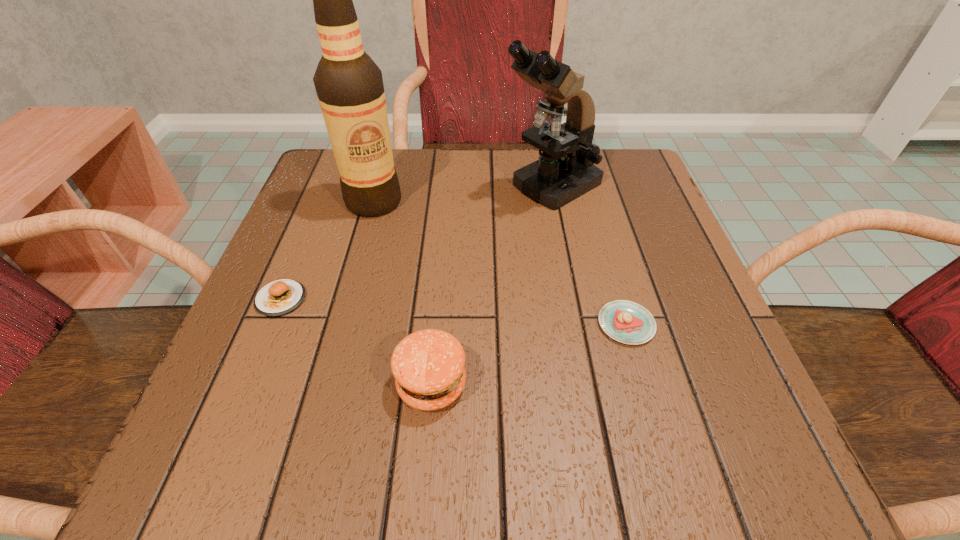
Find the location of `alcohol`. alcohol is located at coordinates (349, 85).

At what (x,y) coordinates should I click in order to perform the action: click on the fourth object from right to left. Please return your answer as a coordinate pair (x, y). This screenshot has height=540, width=960. Looking at the image, I should click on (349, 85).

Image resolution: width=960 pixels, height=540 pixels. In order to click on the fourth shortest object in this screenshot , I will do `click(565, 171)`.

Find the location of a particular element. The height and width of the screenshot is (540, 960). the taller food is located at coordinates (428, 365).

The width and height of the screenshot is (960, 540). In order to click on the third tallest object in this screenshot , I will do `click(428, 365)`.

In order to click on the leftmost object in this screenshot , I will do `click(280, 297)`.

Locate an element on the screen. This screenshot has height=540, width=960. the left food is located at coordinates (280, 297).

At what (x,y) coordinates should I click in order to perform the action: click on pastry. Please return your answer as a coordinate pair (x, y). This screenshot has width=960, height=540. Looking at the image, I should click on (627, 322).

I want to click on free space located on the label of the second object from left to right, so pos(339,328).

Locate an element on the screen. The height and width of the screenshot is (540, 960). free spot located on the right of the fourth shortest object is located at coordinates (635, 186).